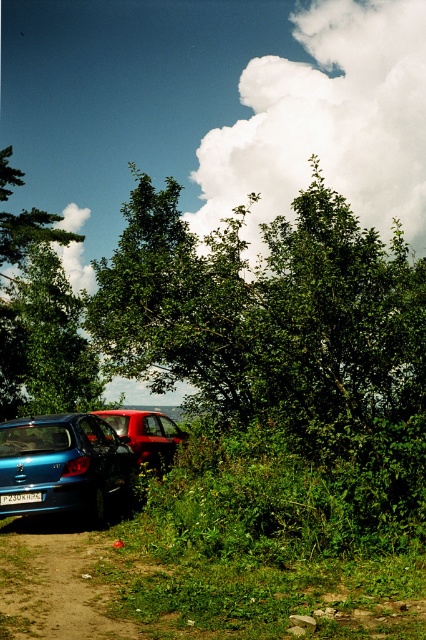
Question: Estimate the real-world distances between objects in this image. Which object is farther from the metallic blue sedan at lower left?

Choices:
 (A) green leafy tree at center
 (B) matte red sedan at center
 (C) white plastic license plate at lower center
 (D) brown dirt track at lower left

Answer: (D)

Question: Is brown dirt track at lower left smaller than matte red sedan at center?

Choices:
 (A) yes
 (B) no

Answer: (A)

Question: From the image, what is the correct spatial relationship of green leafy tree at center in relation to brown dirt track at lower left?

Choices:
 (A) right
 (B) left

Answer: (A)

Question: Which object appears closest to the camera in this image?

Choices:
 (A) white plastic license plate at lower center
 (B) metallic blue sedan at lower left
 (C) matte red sedan at center
 (D) green leafy tree at center

Answer: (D)

Question: Is green leafy tree at center to the left of brown dirt track at lower left from the viewer's perspective?

Choices:
 (A) yes
 (B) no

Answer: (B)

Question: Which object is the farthest from the matte red sedan at center?

Choices:
 (A) metallic blue sedan at lower left
 (B) green leafy tree at center

Answer: (B)